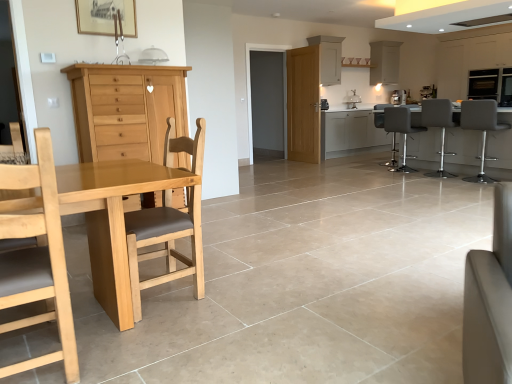
Question: Considering the relative sizes of matte gray barstools at right and matte grey bar stool at right, which ranks as the fifth chair in front-to-back order, in the image provided, is matte gray barstools at right shorter than matte grey bar stool at right, which ranks as the fifth chair in front-to-back order,?

Choices:
 (A) no
 (B) yes

Answer: (B)

Question: Is matte gray barstools at right with matte grey bar stool at right, positioned as the third chair in left-to-right order?

Choices:
 (A) no
 (B) yes

Answer: (A)

Question: Can you confirm if matte gray barstools at right is smaller than matte grey bar stool at right, which ranks as the fifth chair in front-to-back order?

Choices:
 (A) yes
 (B) no

Answer: (B)

Question: Does matte gray barstools at right have a greater height compared to matte grey bar stool at right, which ranks as the second chair in back-to-front order?

Choices:
 (A) yes
 (B) no

Answer: (B)

Question: Can you confirm if matte gray barstools at right is bigger than matte grey bar stool at right, which is the 4th chair in right-to-left order?

Choices:
 (A) no
 (B) yes

Answer: (B)

Question: Considering the relative positions of matte gray barstools at right and matte grey bar stool at right, which ranks as the second chair in back-to-front order, in the image provided, is matte gray barstools at right in front of matte grey bar stool at right, which ranks as the second chair in back-to-front order,?

Choices:
 (A) yes
 (B) no

Answer: (A)

Question: Is white glossy exhaust hood at upper center located outside light brown wood chair at left, which ranks as the 5th chair in right-to-left order?

Choices:
 (A) no
 (B) yes

Answer: (B)

Question: Considering the relative sizes of white glossy exhaust hood at upper center and light brown wood chair at left, which appears as the fifth chair when viewed from the back, in the image provided, is white glossy exhaust hood at upper center smaller than light brown wood chair at left, which appears as the fifth chair when viewed from the back,?

Choices:
 (A) yes
 (B) no

Answer: (B)

Question: Is white glossy exhaust hood at upper center at the right side of light brown wood chair at left, the 2th chair positioned from the left?

Choices:
 (A) no
 (B) yes

Answer: (B)

Question: From a real-world perspective, is white glossy exhaust hood at upper center physically above light brown wood chair at left, the 2th chair from the front?

Choices:
 (A) no
 (B) yes

Answer: (B)

Question: Is white glossy exhaust hood at upper center with light brown wood chair at left, the 2th chair positioned from the left?

Choices:
 (A) no
 (B) yes

Answer: (A)

Question: From the image's perspective, does white glossy exhaust hood at upper center appear lower than light brown wood chair at left, which appears as the fifth chair when viewed from the back?

Choices:
 (A) no
 (B) yes

Answer: (A)

Question: Does wooden picture frame at upper center lie in front of white glossy cabinet at upper center, which is counted as the second cabinetry, starting from the right?

Choices:
 (A) yes
 (B) no

Answer: (A)